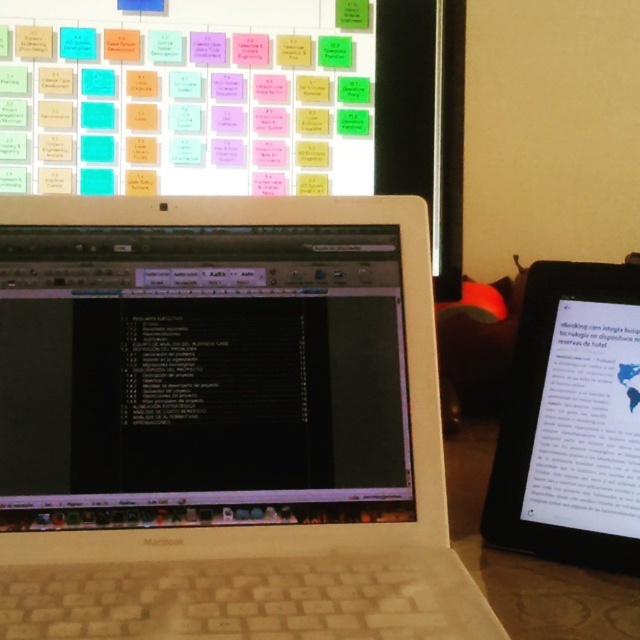
Question: From the image, what is the correct spatial relationship of white plastic laptop at center in relation to black glossy tablet at right?

Choices:
 (A) below
 (B) above

Answer: (B)

Question: From the image, what is the correct spatial relationship of white plastic laptop at center in relation to black glossy tablet at right?

Choices:
 (A) below
 (B) above

Answer: (B)

Question: Among these objects, which one is farthest from the camera?

Choices:
 (A) white plastic laptop at center
 (B) black glossy tablet at right

Answer: (B)

Question: Is the position of white plastic laptop at center more distant than that of black glossy tablet at right?

Choices:
 (A) no
 (B) yes

Answer: (A)